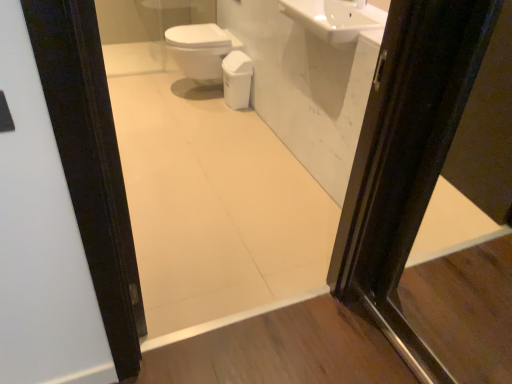
What is the approximate height of white glossy toilet bowl at center?

It is 15.09 inches.

Find the location of a particular element. This screenshot has height=384, width=512. white glossy toilet bowl at center is located at coordinates (237, 79).

In order to face white glossy sink at upper center, should I rotate leftwards or rightwards?

To face it directly, rotate right by 10.806 degrees.

Where is `white glossy bidet at center`? This screenshot has height=384, width=512. white glossy bidet at center is located at coordinates (201, 50).

Considering the sizes of objects white glossy sink at upper center and white glossy toilet bowl at center in the image provided, who is wider, white glossy sink at upper center or white glossy toilet bowl at center?

With larger width is white glossy sink at upper center.

How much distance is there between white glossy sink at upper center and white glossy toilet bowl at center?

white glossy sink at upper center and white glossy toilet bowl at center are 3.37 feet apart from each other.

Who is taller, white glossy sink at upper center or white glossy toilet bowl at center?

white glossy toilet bowl at center.

Does white glossy sink at upper center appear on the right side of white glossy toilet bowl at center?

Correct, you'll find white glossy sink at upper center to the right of white glossy toilet bowl at center.

Does white glossy bidet at center turn towards white glossy sink at upper center?

No, white glossy bidet at center is not turned towards white glossy sink at upper center.

Between white glossy bidet at center and white glossy sink at upper center, which one appears on the right side from the viewer's perspective?

white glossy sink at upper center is more to the right.

Is white glossy bidet at center next to white glossy sink at upper center?

white glossy bidet at center and white glossy sink at upper center are not in contact.

Which object is wider, white glossy bidet at center or white glossy sink at upper center?

white glossy bidet at center is wider.

Can you confirm if white glossy bidet at center is taller than white glossy toilet bowl at center?

Yes, white glossy bidet at center is taller than white glossy toilet bowl at center.

Which of these two, white glossy bidet at center or white glossy toilet bowl at center, is wider?

Wider between the two is white glossy bidet at center.

Is white glossy bidet at center far away from white glossy toilet bowl at center?

white glossy bidet at center is near white glossy toilet bowl at center, not far away.

Based on their positions, is white glossy sink at upper center located to the left or right of white glossy bidet at center?

Clearly, white glossy sink at upper center is on the right of white glossy bidet at center in the image.

Consider the image. Considering the sizes of objects white glossy sink at upper center and white glossy bidet at center in the image provided, who is smaller, white glossy sink at upper center or white glossy bidet at center?

Smaller between the two is white glossy sink at upper center.

Does white glossy sink at upper center have a lesser width compared to white glossy bidet at center?

Yes, white glossy sink at upper center is thinner than white glossy bidet at center.

Is white glossy sink at upper center far away from white glossy bidet at center?

Yes, white glossy sink at upper center is far from white glossy bidet at center.

Is white glossy mirror at upper center positioned beyond the bounds of white glossy sink at upper center?

Yes.

Is white glossy mirror at upper center to the right of white glossy sink at upper center from the viewer's perspective?

In fact, white glossy mirror at upper center is to the left of white glossy sink at upper center.

From a real-world perspective, relative to white glossy sink at upper center, is white glossy mirror at upper center vertically above or below?

In terms of real-world spatial position, white glossy mirror at upper center is below white glossy sink at upper center.

Would you say white glossy mirror at upper center is a long distance from white glossy sink at upper center?

white glossy mirror at upper center is actually quite close to white glossy sink at upper center.

From a real-world perspective, is white glossy mirror at upper center over white glossy bidet at center?

Yes, from a real-world perspective, white glossy mirror at upper center is above white glossy bidet at center.

From the picture: Is there a large distance between white glossy mirror at upper center and white glossy bidet at center?

Actually, white glossy mirror at upper center and white glossy bidet at center are a little close together.

Can you confirm if white glossy mirror at upper center is bigger than white glossy bidet at center?

No, white glossy mirror at upper center is not bigger than white glossy bidet at center.

Does white glossy mirror at upper center turn towards white glossy bidet at center?

Yes, white glossy mirror at upper center is oriented towards white glossy bidet at center.

In the scene shown: From the image's perspective, would you say white glossy toilet bowl at center is shown under white glossy bidet at center?

Yes, from the image's perspective, white glossy toilet bowl at center is below white glossy bidet at center.

Does white glossy toilet bowl at center appear on the right side of white glossy bidet at center?

Yes.

Looking at this image, considering the sizes of white glossy toilet bowl at center and white glossy bidet at center in the image, is white glossy toilet bowl at center bigger or smaller than white glossy bidet at center?

Considering their sizes, white glossy toilet bowl at center takes up less space than white glossy bidet at center.

Is white glossy toilet bowl at center facing away from white glossy bidet at center?

No, white glossy toilet bowl at center is not facing the opposite direction of white glossy bidet at center.

In the image, there is a white glossy toilet bowl at center. Identify the location of sink above it (from the image's perspective). (336, 20).

You are a GUI agent. You are given a task and a screenshot of the screen. Output one action in this format:
    pyautogui.click(x=<x>, y=<y>)
    Task: Click on the bidet below the white glossy sink at upper center (from a real-world perspective)
    
    Given the screenshot: What is the action you would take?
    pyautogui.click(x=201, y=50)

Looking at the image, which one is located further to white glossy toilet bowl at center, white glossy sink at upper center or white glossy bidet at center?

The object further to white glossy toilet bowl at center is white glossy sink at upper center.

When comparing their distances from white glossy bidet at center, does white glossy mirror at upper center or white glossy toilet bowl at center seem closer?

white glossy toilet bowl at center lies closer to white glossy bidet at center than the other object.

Estimate the real-world distances between objects in this image. Which object is further from white glossy mirror at upper center, white glossy bidet at center or white glossy toilet bowl at center?

white glossy bidet at center.

Looking at the image, which one is located closer to white glossy toilet bowl at center, white glossy bidet at center or white glossy sink at upper center?

The object closer to white glossy toilet bowl at center is white glossy bidet at center.

In the scene shown: Considering their positions, is white glossy sink at upper center positioned further to white glossy mirror at upper center than white glossy bidet at center?

The object further to white glossy mirror at upper center is white glossy bidet at center.

Looking at the image, which one is located closer to white glossy sink at upper center, white glossy mirror at upper center or white glossy bidet at center?

Based on the image, white glossy mirror at upper center appears to be nearer to white glossy sink at upper center.

Considering their positions, is white glossy bidet at center positioned closer to white glossy toilet bowl at center than white glossy mirror at upper center?

Based on the image, white glossy bidet at center appears to be nearer to white glossy toilet bowl at center.

When comparing their distances from white glossy bidet at center, does white glossy toilet bowl at center or white glossy mirror at upper center seem closer?

white glossy toilet bowl at center is positioned closer to the anchor white glossy bidet at center.

Locate an element on the screen. This screenshot has width=512, height=384. sink positioned between white glossy mirror at upper center and white glossy bidet at center from near to far is located at coordinates (336, 20).

What are the coordinates of `bidet positioned between white glossy mirror at upper center and white glossy toilet bowl at center from near to far` in the screenshot? It's located at (201, 50).

This screenshot has height=384, width=512. What are the coordinates of `sink positioned between white glossy mirror at upper center and white glossy toilet bowl at center from near to far` in the screenshot? It's located at (336, 20).

Locate an element on the screen. bidet between white glossy sink at upper center and white glossy toilet bowl at center in the front-back direction is located at coordinates (201, 50).